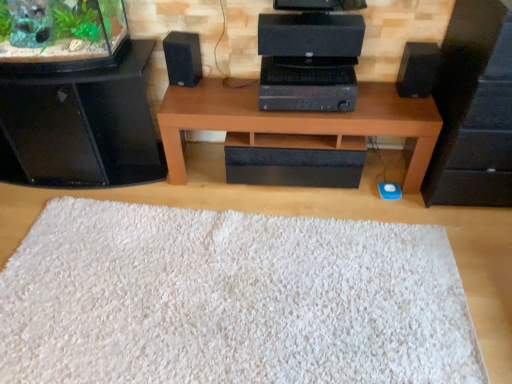
This screenshot has height=384, width=512. I want to click on free area in between black matte speaker at right, the 1th furniture from the right, and brown wood table at center, so click(x=334, y=205).